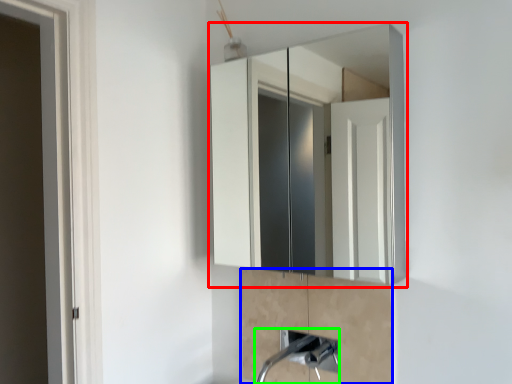
Question: Which object is the closest to the medicine cabinet (highlighted by a red box)? Choose among these: cabinetry (highlighted by a blue box) or plumbing fixture (highlighted by a green box).

Choices:
 (A) cabinetry
 (B) plumbing fixture

Answer: (A)